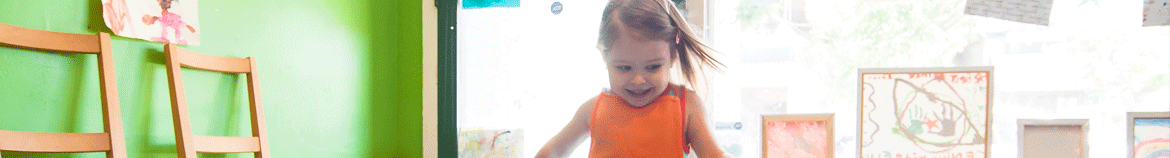
Find the location of `green wall`. green wall is located at coordinates (360, 61).